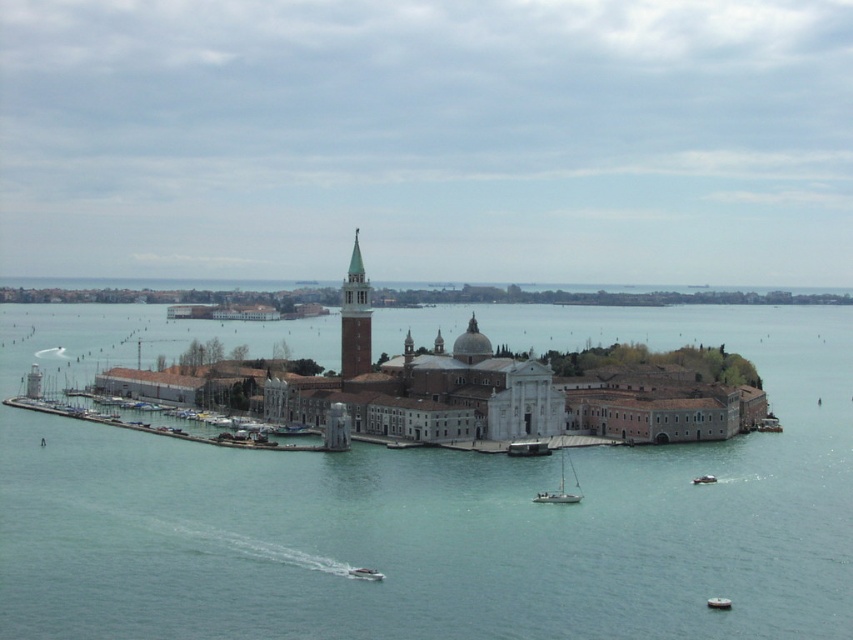
Is green marble bell tower at center further to camera compared to metallic gray boat at lower center?

Yes, it is.

Does green marble bell tower at center have a greater width compared to metallic gray boat at lower center?

Indeed, green marble bell tower at center has a greater width compared to metallic gray boat at lower center.

Is point (352, 298) less distant than point (350, 572)?

No, it is behind (350, 572).

What are the coordinates of `green marble bell tower at center` in the screenshot? It's located at (355, 317).

Can you confirm if clear blue water at center is taller than white plastic boat at lower right?

Correct, clear blue water at center is much taller as white plastic boat at lower right.

Does clear blue water at center appear over white plastic boat at lower right?

Correct, clear blue water at center is located above white plastic boat at lower right.

Locate an element on the screen. clear blue water at center is located at coordinates (451, 516).

Find the location of `clear blue water at center`. clear blue water at center is located at coordinates (451, 516).

Between clear blue water at center and metallic gray sailboat at center, which one has more height?

Standing taller between the two is clear blue water at center.

Between clear blue water at center and metallic gray sailboat at center, which one is positioned higher?

clear blue water at center is higher up.

Who is more distant from viewer, (573, 548) or (532, 456)?

Positioned behind is point (532, 456).

The image size is (853, 640). I want to click on clear blue water at center, so click(451, 516).